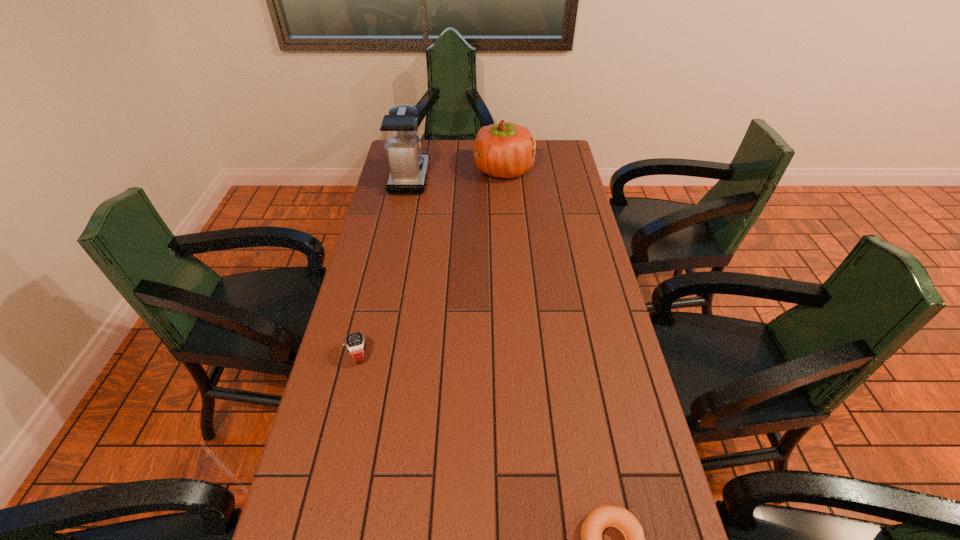
Identify the location of pumpkin that is at the far edge. This screenshot has width=960, height=540. (506, 150).

Identify the location of coffee maker present at the left edge. (399, 130).

Image resolution: width=960 pixels, height=540 pixels. Identify the location of watch that is at the left edge. (355, 343).

Locate an element on the screen. This screenshot has height=540, width=960. object at the far left corner is located at coordinates pos(399,130).

The width and height of the screenshot is (960, 540). Identify the location of free space at the far edge. (471, 158).

The image size is (960, 540). I want to click on blank space at the left edge, so click(366, 394).

In the image, there is a desktop. At what (x,y) coordinates should I click in order to perform the action: click on free space at the right edge. Please return your answer as a coordinate pair (x, y). The width and height of the screenshot is (960, 540). Looking at the image, I should click on (540, 198).

This screenshot has height=540, width=960. Identify the location of vacant space at the far right corner of the desktop. (551, 155).

What are the coordinates of `vacant point located between the coffee maker and the third shortest object` in the screenshot? It's located at (457, 174).

This screenshot has width=960, height=540. Identify the location of vacant area between the tallest object and the pumpkin. (457, 174).